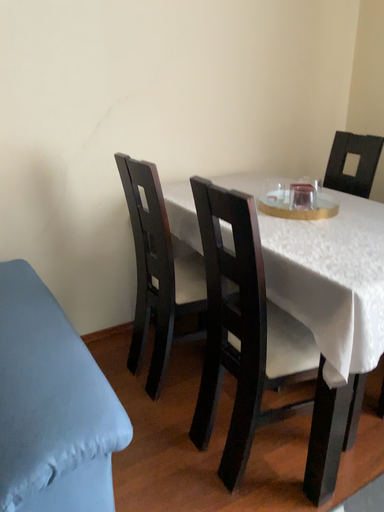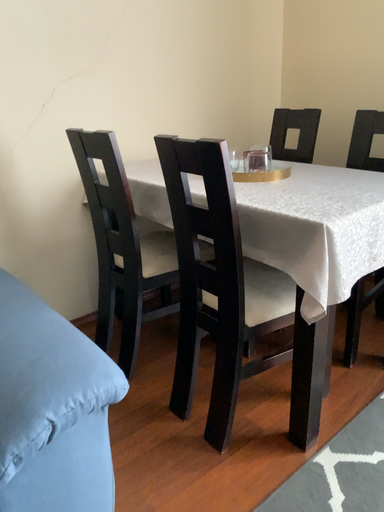
Question: Which way did the camera rotate in the video?

Choices:
 (A) rotated left
 (B) rotated right

Answer: (B)